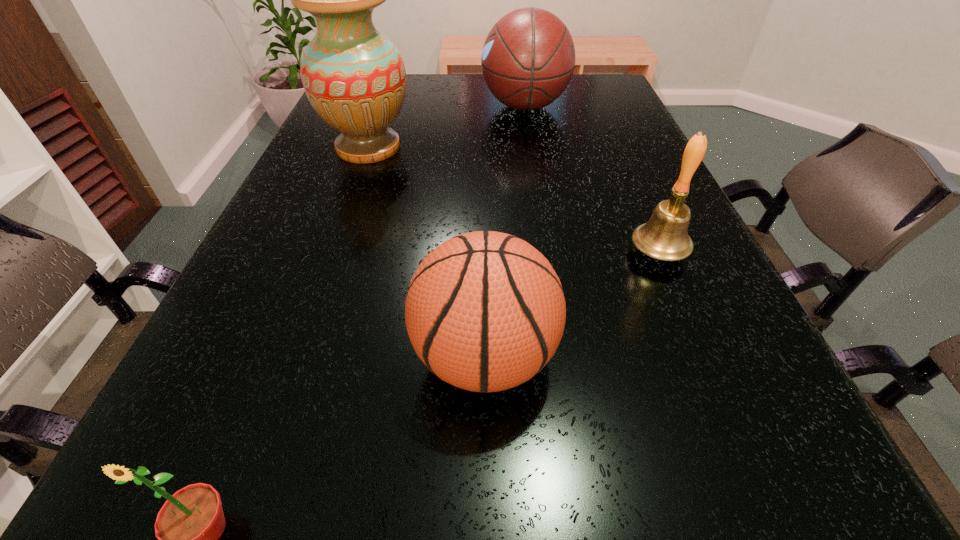
This screenshot has height=540, width=960. What are the coordinates of `vacant region located on the side where the inflation valve is located` in the screenshot? It's located at [205, 357].

The image size is (960, 540). In order to click on free region located on the side where the inflation valve is located in this screenshot , I will do `click(337, 357)`.

Find the location of a particular element. object that is at the far edge is located at coordinates (528, 59).

The width and height of the screenshot is (960, 540). I want to click on object that is at the left edge, so click(x=354, y=77).

The width and height of the screenshot is (960, 540). What are the coordinates of `basketball that is positioned at the right edge` in the screenshot? It's located at (528, 59).

This screenshot has width=960, height=540. In order to click on bell present at the right edge in this screenshot , I will do `click(665, 236)`.

The image size is (960, 540). In order to click on object present at the far right corner in this screenshot , I will do `click(528, 59)`.

Where is `free space at the far edge of the desktop`? free space at the far edge of the desktop is located at coordinates (448, 94).

The image size is (960, 540). In the image, there is a desktop. What are the coordinates of `free space at the near edge` in the screenshot? It's located at (452, 534).

I want to click on free region at the left edge, so click(290, 240).